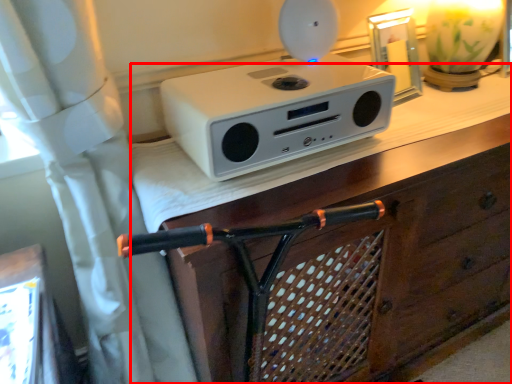
Question: From the image's perspective, where is vanity (annotated by the red box) located relative to home appliance?

Choices:
 (A) above
 (B) below

Answer: (B)